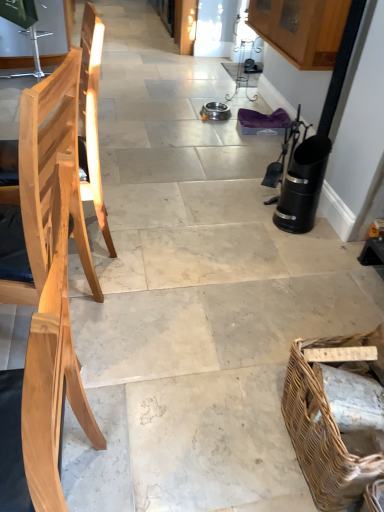
You are a GUI agent. You are given a task and a screenshot of the screen. Output one action in this format:
    pyautogui.click(x=<x>, y=<y>)
    Task: Click on the free space to the back side of brown woven picnic basket at lower right
    
    Given the screenshot: What is the action you would take?
    pyautogui.click(x=295, y=327)